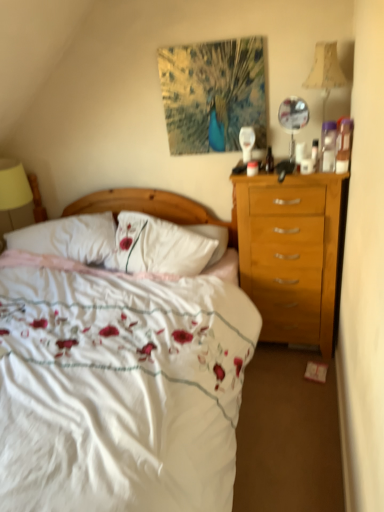
Question: Would you say white soft pillow at center is to the left or to the right of white floral duvet at center in the picture?

Choices:
 (A) left
 (B) right

Answer: (A)

Question: Is white soft pillow at center bigger or smaller than white floral duvet at center?

Choices:
 (A) small
 (B) big

Answer: (A)

Question: Considering the real-world distances, which object is closest to the beige fabric lampshade at upper right?

Choices:
 (A) wooden headboard at center
 (B) white soft pillow at center
 (C) white floral duvet at center

Answer: (A)

Question: Estimate the real-world distances between objects in this image. Which object is closer to the white soft pillow at center?

Choices:
 (A) beige fabric lampshade at upper right
 (B) wooden headboard at center
 (C) white floral duvet at center

Answer: (B)